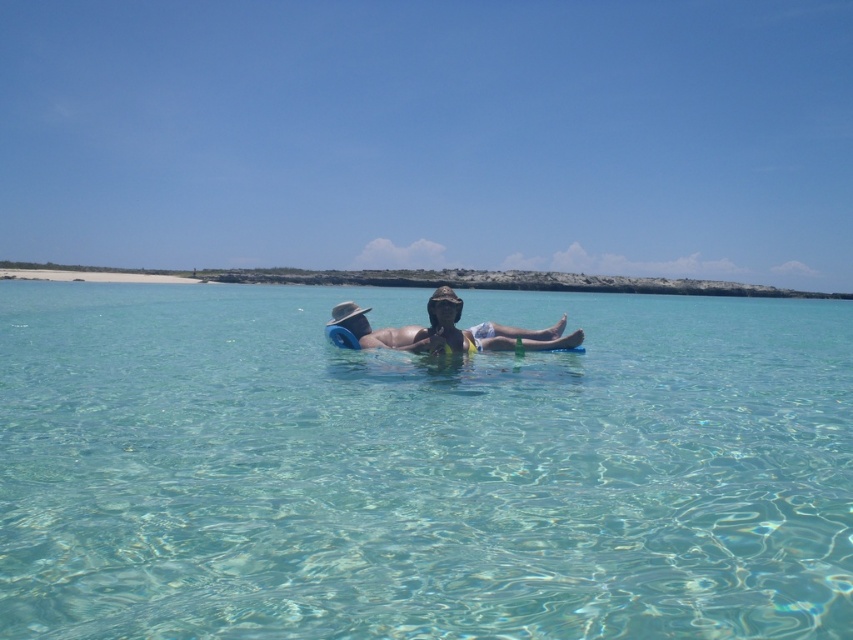
Question: Is the position of clear water at center more distant than that of matte blue pool float at center?

Choices:
 (A) yes
 (B) no

Answer: (B)

Question: Observing the image, what is the correct spatial positioning of clear water at center in reference to matte blue pool float at center?

Choices:
 (A) above
 (B) below

Answer: (A)

Question: Which of the following is the farthest from the observer?

Choices:
 (A) (421, 346)
 (B) (144, 324)

Answer: (B)

Question: Can you confirm if clear water at center is positioned to the right of matte blue pool float at center?

Choices:
 (A) no
 (B) yes

Answer: (A)

Question: Which point is farther from the camera taking this photo?

Choices:
 (A) (612, 470)
 (B) (448, 300)

Answer: (B)